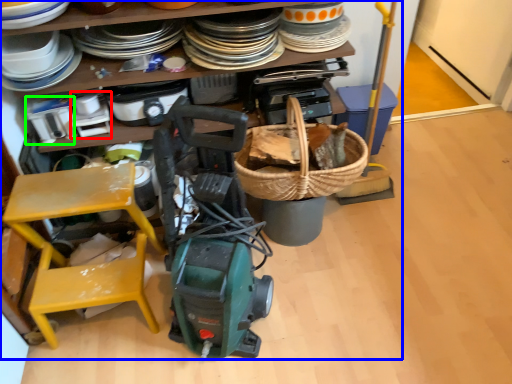
Question: Which object is the farthest from appliance (highlighted by a red box)? Choose among these: collection (highlighted by a blue box) or appliance (highlighted by a green box).

Choices:
 (A) collection
 (B) appliance

Answer: (A)